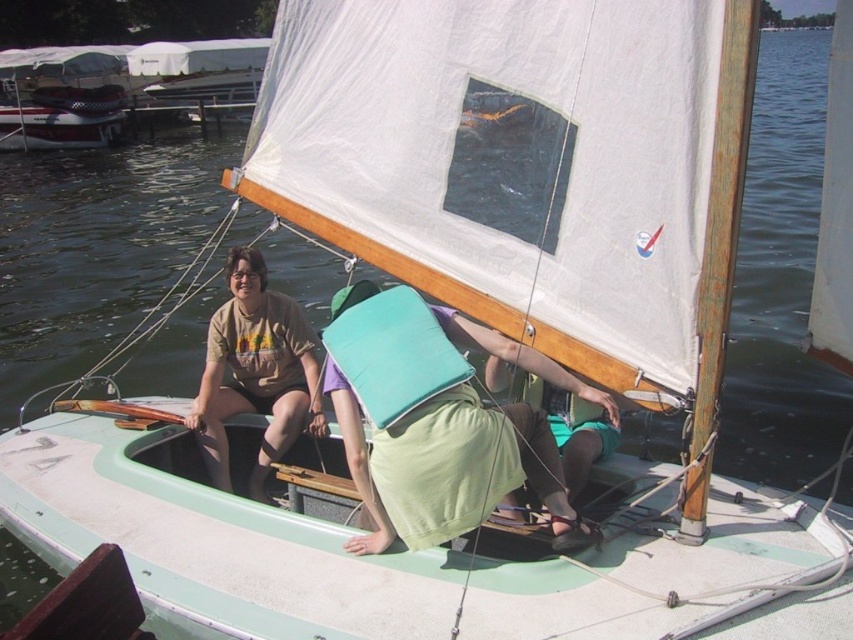
Question: Can you confirm if matte green cushion at center is thinner than brown cotton t-shirt at center?

Choices:
 (A) no
 (B) yes

Answer: (A)

Question: Among these points, which one is nearest to the camera?

Choices:
 (A) (581, 524)
 (B) (221, 316)

Answer: (A)

Question: Which point is farther to the camera?

Choices:
 (A) (241, 397)
 (B) (437, 419)

Answer: (A)

Question: Considering the relative positions of matte green cushion at center and brown cotton t-shirt at center in the image provided, where is matte green cushion at center located with respect to brown cotton t-shirt at center?

Choices:
 (A) below
 (B) above

Answer: (A)

Question: In this image, where is matte green cushion at center located relative to brown cotton t-shirt at center?

Choices:
 (A) right
 (B) left

Answer: (A)

Question: Which object appears closest to the camera in this image?

Choices:
 (A) matte green cushion at center
 (B) brown cotton t-shirt at center

Answer: (A)